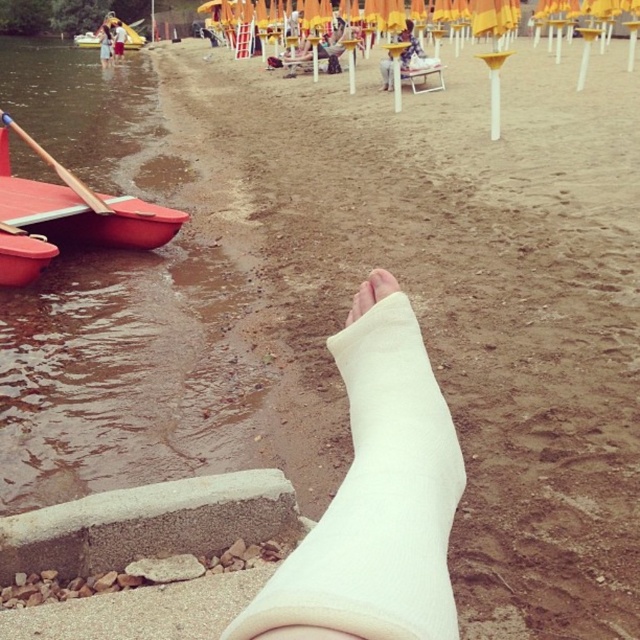
You are a lifeguard on duty at the lakeside. You notice the wooden paddle at left and the white cast leg at lower center. Which object is positioned to the right of the other?

The wooden paddle at left is to the right of the white cast leg at lower center.

You are a photographer setting up a shoot at the lakeside. You notice two white objects in the scene. One is labeled as the white fabric cast at center and the other as the white cast at lower center. Which of these two objects is closer to your camera position?

The white fabric cast at center is closer to the camera position because it is in front of the white cast at lower center.

You are a lifeguard on duty at the lakeside. You need to place a first aid kit on the sand between the red plastic boat at upper left and the white cast at lower center. Which object should you place it closer to so that it is equidistant from both?

The red plastic boat at upper left might be wider than white cast at lower center, so to place the first aid kit equidistant from both, it should be placed closer to the white cast at lower center.